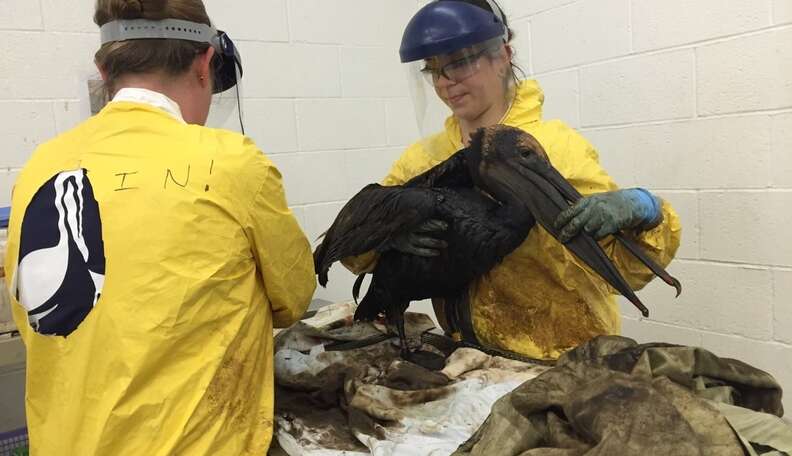
This screenshot has width=792, height=456. I want to click on wall, so click(664, 133), click(305, 128).